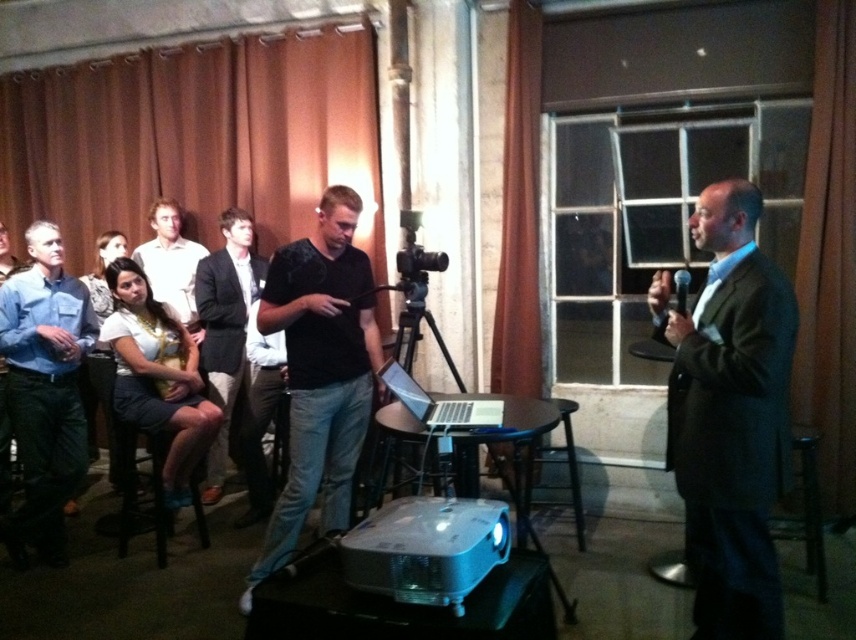
You are organizing a clothing display and need to arrange the blue denim shirt at left and the light brown shirt at center based on their widths. Which shirt should you place on the narrower hanger?

The blue denim shirt at left has a smaller width than the light brown shirt at center, so it should be placed on the narrower hanger.

You are sitting in the audience and looking at the stage. There are two points marked on the stage. One is at coordinate point (229,260) and the other at point (419,260). Which point is closer to you?

Point (229,260) is closer to you because it is further to the viewer than point (419,260).

You are attending a presentation and notice two attendees wearing different shirts. The blue denim shirt at left and the light brown shirt at center. Which shirt is taller?

The blue denim shirt at left is taller than the light brown shirt at center.